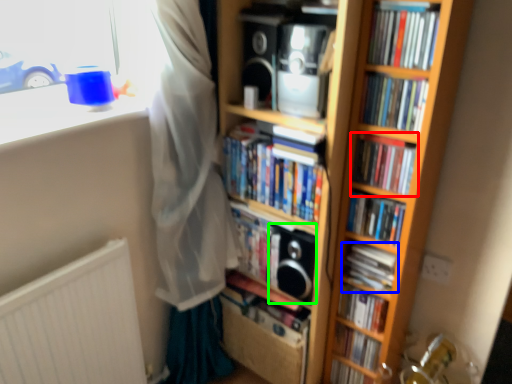
Question: Which is nearer to the book (highlighted by a red box)? book (highlighted by a blue box) or speaker (highlighted by a green box).

Choices:
 (A) book
 (B) speaker

Answer: (A)